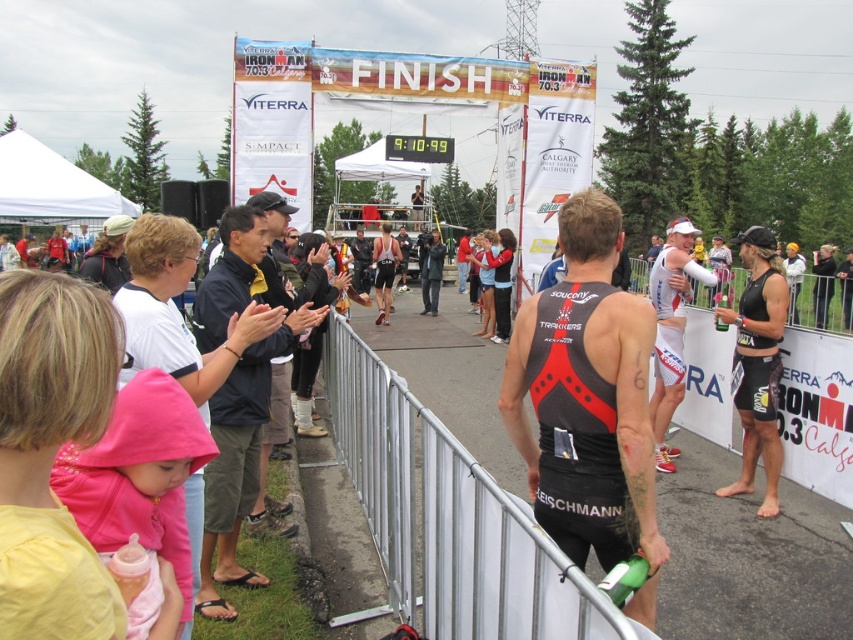
Who is positioned more to the left, dark blue jacket at center or black spandex tank top at center?

Positioned to the left is dark blue jacket at center.

Image resolution: width=853 pixels, height=640 pixels. Describe the element at coordinates (236, 400) in the screenshot. I see `dark blue jacket at center` at that location.

This screenshot has width=853, height=640. What are the coordinates of `dark blue jacket at center` in the screenshot? It's located at (236, 400).

This screenshot has height=640, width=853. In order to click on dark blue jacket at center in this screenshot , I will do `click(236, 400)`.

Does dark blue jacket at center have a lesser width compared to black matte triathlon suit at right?

Incorrect, dark blue jacket at center's width is not less than black matte triathlon suit at right's.

Does point (225, 492) come in front of point (741, 320)?

Yes, point (225, 492) is closer to viewer.

What do you see at coordinates (236, 400) in the screenshot? The image size is (853, 640). I see `dark blue jacket at center` at bounding box center [236, 400].

You are a GUI agent. You are given a task and a screenshot of the screen. Output one action in this format:
    pyautogui.click(x=<x>, y=<y>)
    Task: Click on the dark blue jacket at center
    Image resolution: width=853 pixels, height=640 pixels.
    Given the screenshot: What is the action you would take?
    pyautogui.click(x=236, y=400)

Is black matte triathlon suit at center further to the viewer compared to dark blue jacket at center?

No, it is in front of dark blue jacket at center.

How distant is black matte triathlon suit at center from dark blue jacket at center?

A distance of 1.39 meters exists between black matte triathlon suit at center and dark blue jacket at center.

Is point (604, 232) behind point (285, 316)?

That is False.

Where is `black matte triathlon suit at center`? The image size is (853, 640). black matte triathlon suit at center is located at coordinates (589, 403).